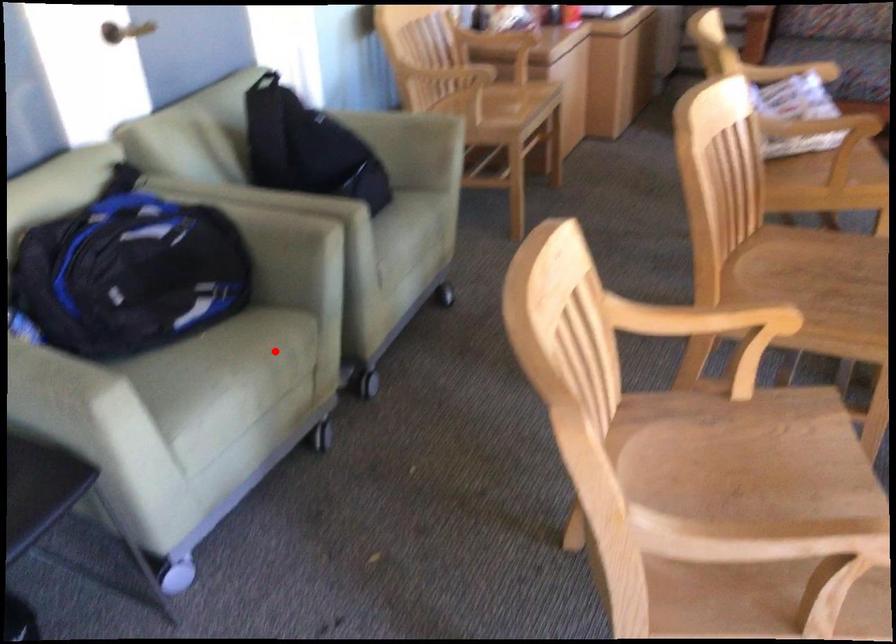
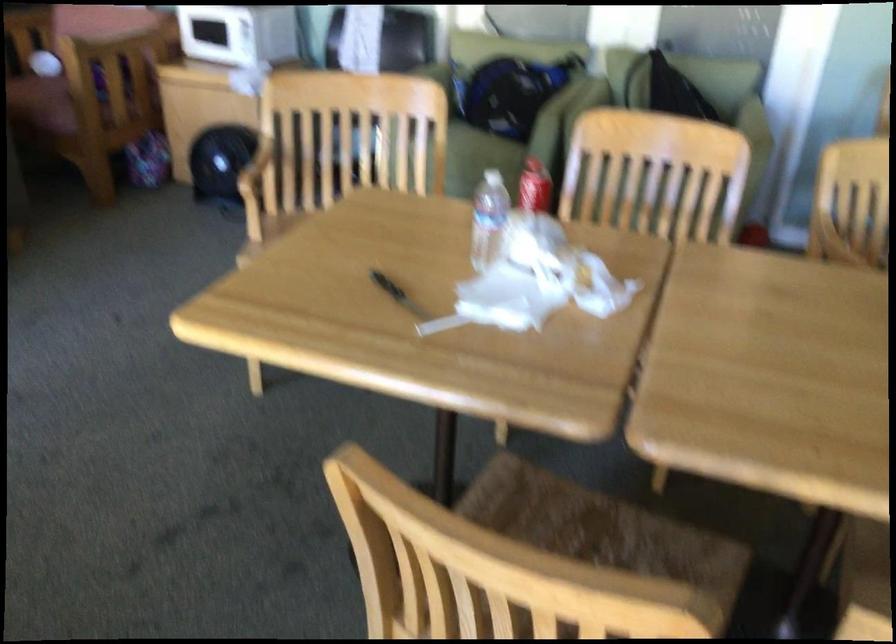
Question: I am providing you with two images of the same scene from different viewpoints. A red point is marked on the first image. At the location where the point appears in image 1, is it still visible in image 2?

Choices:
 (A) Yes
 (B) No

Answer: (A)